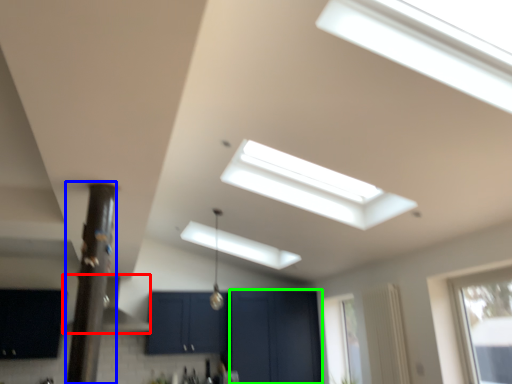
Question: Which is farther away from exhaust hood (highlighted by a red box)? pillar (highlighted by a blue box) or screen door (highlighted by a green box)?

Choices:
 (A) pillar
 (B) screen door

Answer: (A)